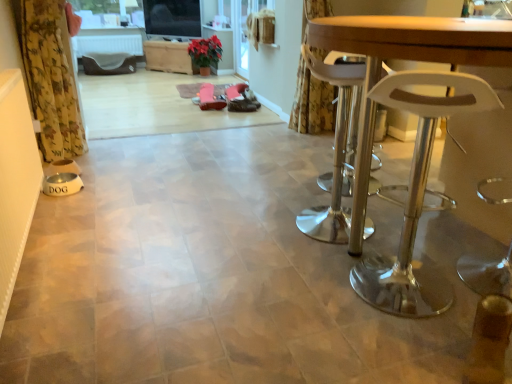
Image resolution: width=512 pixels, height=384 pixels. I want to click on vacant space situated on the left part of clear plastic stool at right, so click(x=310, y=292).